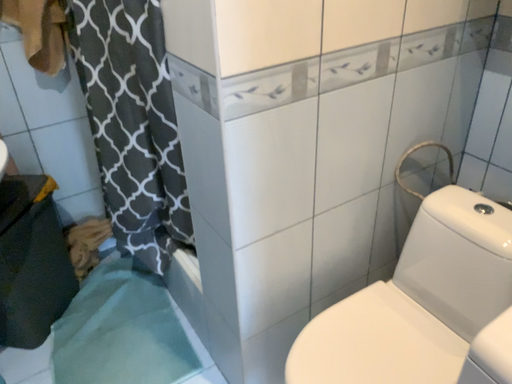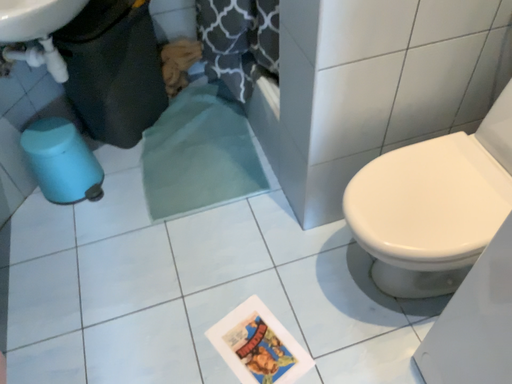
Question: How did the camera likely rotate when shooting the video?

Choices:
 (A) rotated upward
 (B) rotated downward

Answer: (B)